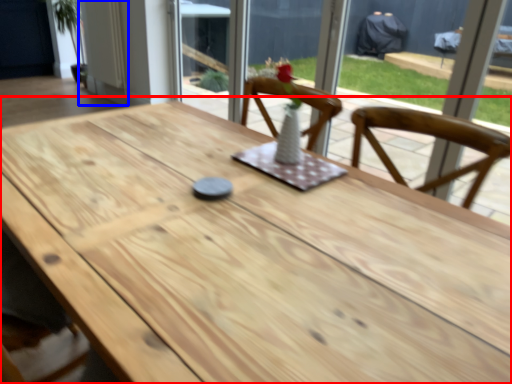
Question: Which object appears farthest to the camera in this image, table (highlighted by a red box) or door (highlighted by a blue box)?

Choices:
 (A) table
 (B) door

Answer: (B)